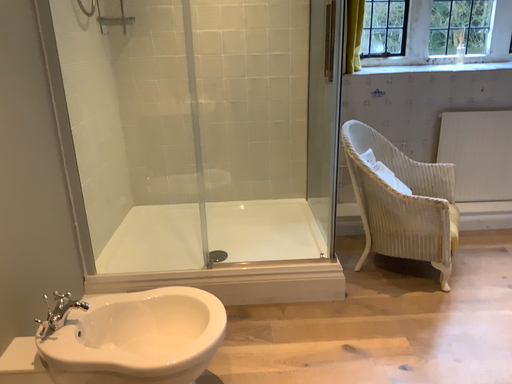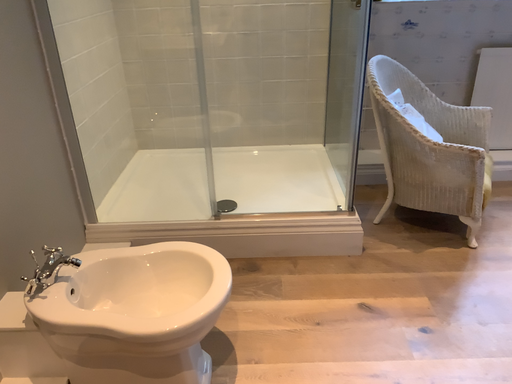
Question: How did the camera likely rotate when shooting the video?

Choices:
 (A) rotated upward
 (B) rotated downward

Answer: (B)